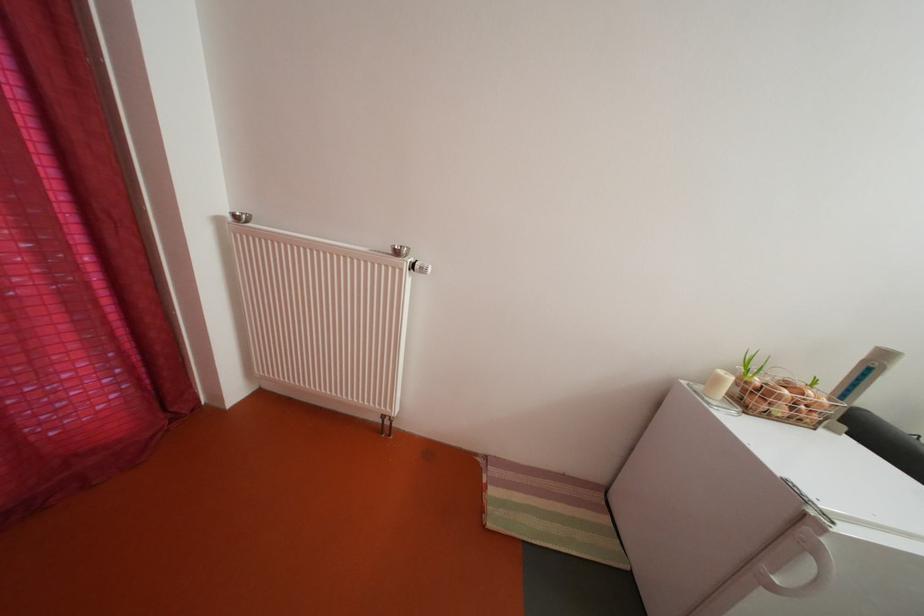
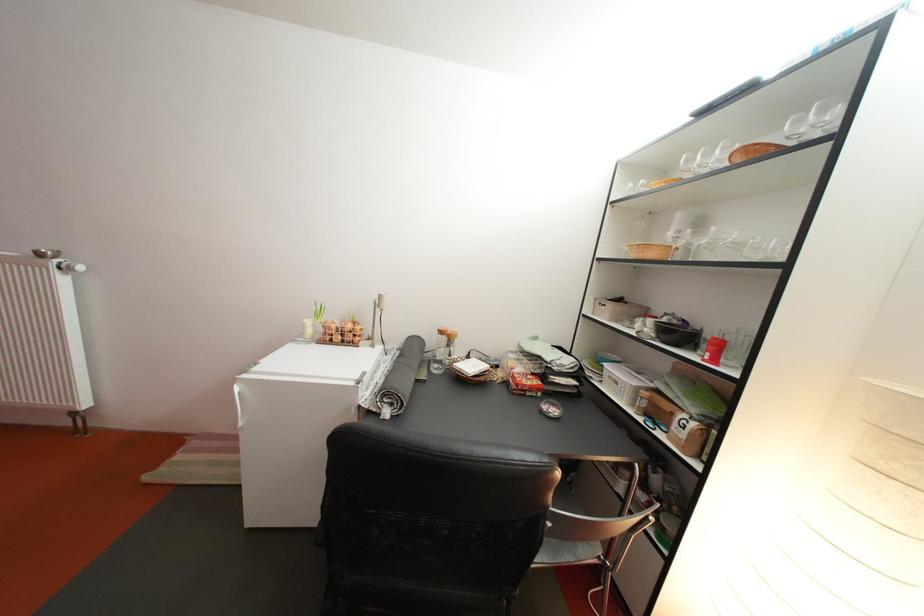
The images are taken continuously from a first-person perspective. In which direction are you moving?

The cameraman moved toward right, backward.